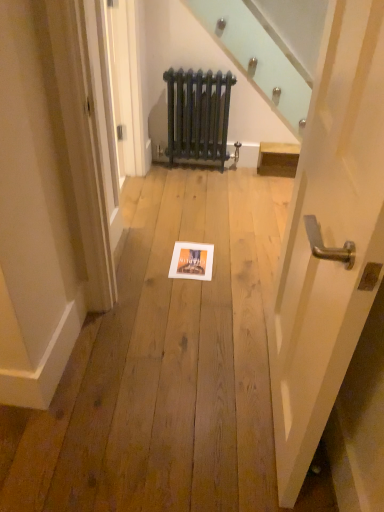
Question: Is matte white picture frame at center wider or thinner than dark blue cast iron radiator at center?

Choices:
 (A) thin
 (B) wide

Answer: (B)

Question: Is matte white picture frame at center taller or shorter than dark blue cast iron radiator at center?

Choices:
 (A) short
 (B) tall

Answer: (A)

Question: Which is nearer to the white glossy door handle at center right?

Choices:
 (A) matte white picture frame at center
 (B) dark blue cast iron radiator at center

Answer: (A)

Question: Which object is the closest to the dark blue cast iron radiator at center?

Choices:
 (A) matte white picture frame at center
 (B) white glossy door handle at center right

Answer: (A)